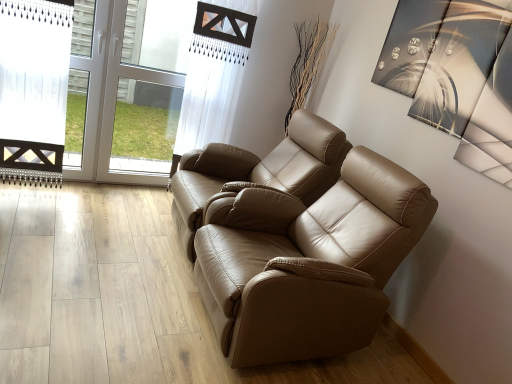
Image resolution: width=512 pixels, height=384 pixels. I want to click on vacant area situated to the left side of tan leather sofa at center, arranged as the second chair when viewed from the front, so click(x=101, y=238).